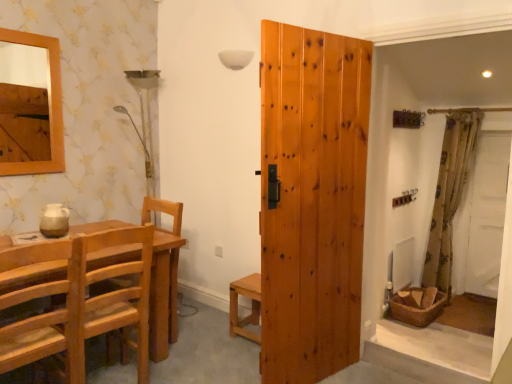
Where is `vacant space situated on the left part of light brown wooden stool at center`? Image resolution: width=512 pixels, height=384 pixels. vacant space situated on the left part of light brown wooden stool at center is located at coordinates (215, 331).